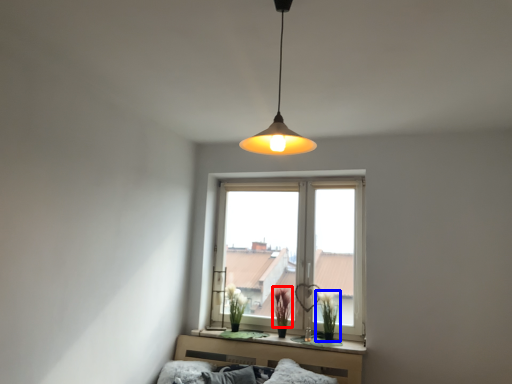
Question: Among these objects, which one is farthest to the camera, plant (highlighted by a red box) or plant (highlighted by a blue box)?

Choices:
 (A) plant
 (B) plant

Answer: (A)